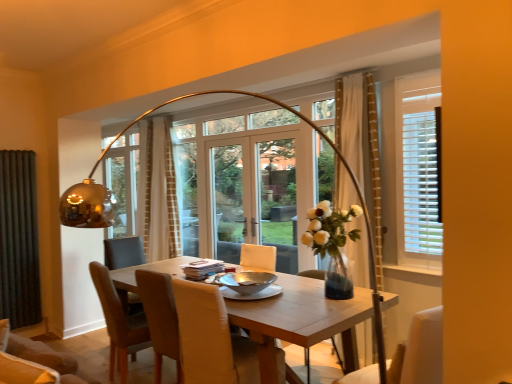
Question: Is black fabric curtain at left, which is the 1th curtain in left-to-right order, completely or partially outside of light brown wooden table at center?

Choices:
 (A) yes
 (B) no

Answer: (A)

Question: Can you confirm if black fabric curtain at left, marked as the 2th curtain in a front-to-back arrangement, is thinner than light brown wooden table at center?

Choices:
 (A) yes
 (B) no

Answer: (A)

Question: Can you confirm if black fabric curtain at left, which is counted as the third curtain, starting from the right, is positioned to the left of light brown wooden table at center?

Choices:
 (A) no
 (B) yes

Answer: (B)

Question: Is black fabric curtain at left, which is the 1th curtain in left-to-right order, to the right of light brown wooden table at center from the viewer's perspective?

Choices:
 (A) no
 (B) yes

Answer: (A)

Question: Is black fabric curtain at left, which is the 1th curtain in left-to-right order, oriented away from light brown wooden table at center?

Choices:
 (A) no
 (B) yes

Answer: (A)

Question: Is white fabric chair at lower right, which is the 1th chair from right to left, wider or thinner than light brown wooden table at center?

Choices:
 (A) wide
 (B) thin

Answer: (B)

Question: Is white fabric chair at lower right, which is the third chair in back-to-front order, bigger or smaller than light brown wooden table at center?

Choices:
 (A) small
 (B) big

Answer: (A)

Question: Considering the positions of point (423, 319) and point (261, 359), is point (423, 319) closer or farther from the camera than point (261, 359)?

Choices:
 (A) closer
 (B) farther

Answer: (A)

Question: Would you say white fabric chair at lower right, the 1th chair when ordered from front to back, is to the left or to the right of light brown wooden table at center in the picture?

Choices:
 (A) left
 (B) right

Answer: (B)

Question: Considering the positions of point (159, 251) and point (305, 311), is point (159, 251) closer or farther from the camera than point (305, 311)?

Choices:
 (A) closer
 (B) farther

Answer: (B)

Question: Is beige textured curtain at center, the 2th curtain from the left, in front of or behind light brown wooden table at center in the image?

Choices:
 (A) front
 (B) behind

Answer: (B)

Question: From their relative heights in the image, would you say beige textured curtain at center, which is the 2th curtain in right-to-left order, is taller or shorter than light brown wooden table at center?

Choices:
 (A) tall
 (B) short

Answer: (A)

Question: In terms of width, does beige textured curtain at center, the 2th curtain from the left, look wider or thinner when compared to light brown wooden table at center?

Choices:
 (A) wide
 (B) thin

Answer: (B)

Question: Is light brown wooden table at center inside the boundaries of brown leather chair at center, acting as the first chair starting from the left, or outside?

Choices:
 (A) outside
 (B) inside

Answer: (A)

Question: Is point (178, 268) positioned closer to the camera than point (110, 286)?

Choices:
 (A) closer
 (B) farther

Answer: (B)